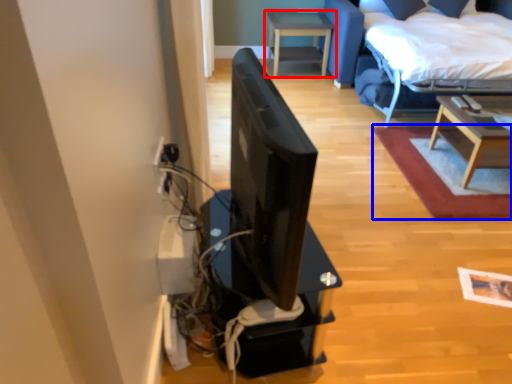
Question: Among these objects, which one is nearest to the camera, table (highlighted by a red box) or plain (highlighted by a blue box)?

Choices:
 (A) table
 (B) plain

Answer: (B)